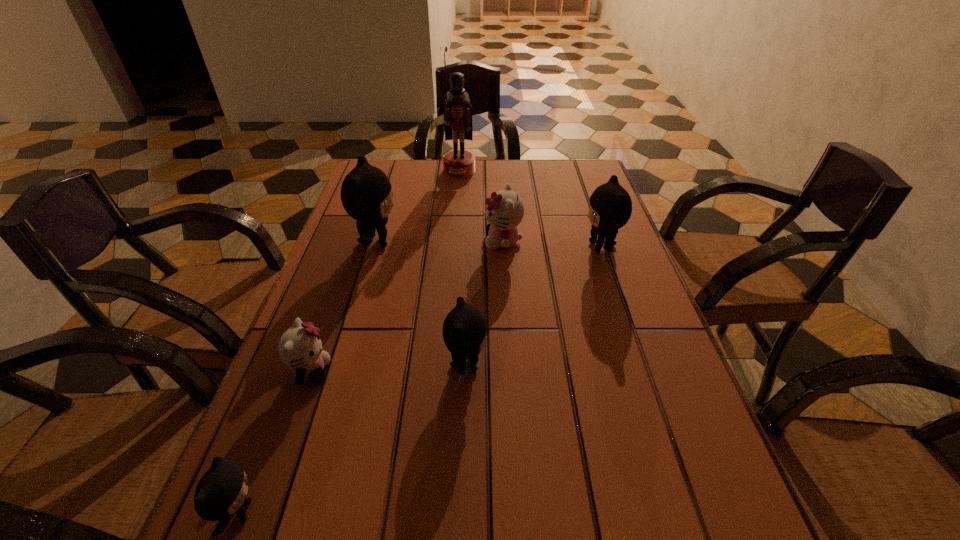
Identify the location of red nutcracker. Image resolution: width=960 pixels, height=540 pixels. (457, 111).

I want to click on nutcracker, so click(457, 111).

Locate an element on the screen. The width and height of the screenshot is (960, 540). the seventh shortest object is located at coordinates (366, 194).

I want to click on the biggest gray kitten, so click(x=366, y=194).

Find the location of `the rightmost gray kitten`. the rightmost gray kitten is located at coordinates (610, 206).

This screenshot has width=960, height=540. In order to click on the third smallest gray kitten in this screenshot , I will do `click(610, 206)`.

Locate an element on the screen. The height and width of the screenshot is (540, 960). the bigger white kitten is located at coordinates (505, 211).

Locate an element on the screen. This screenshot has height=540, width=960. the farther white kitten is located at coordinates (505, 211).

In order to click on the second gray kitten from right to left in this screenshot , I will do `click(464, 330)`.

This screenshot has height=540, width=960. I want to click on the third farthest gray kitten, so click(x=464, y=330).